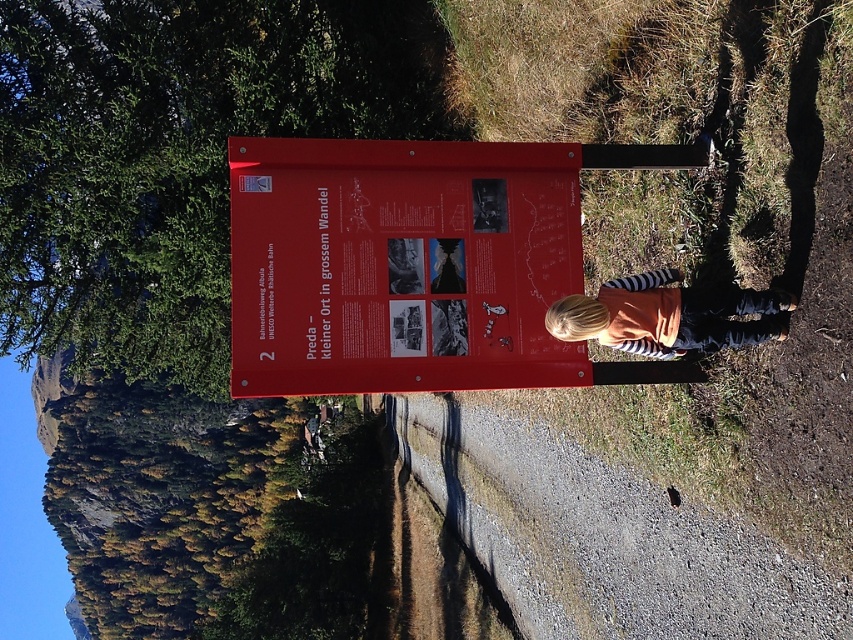
Which is below, red matte sign at center or orange cotton shirt at center?

orange cotton shirt at center

This screenshot has height=640, width=853. Describe the element at coordinates (399, 266) in the screenshot. I see `red matte sign at center` at that location.

The height and width of the screenshot is (640, 853). I want to click on red matte sign at center, so click(399, 266).